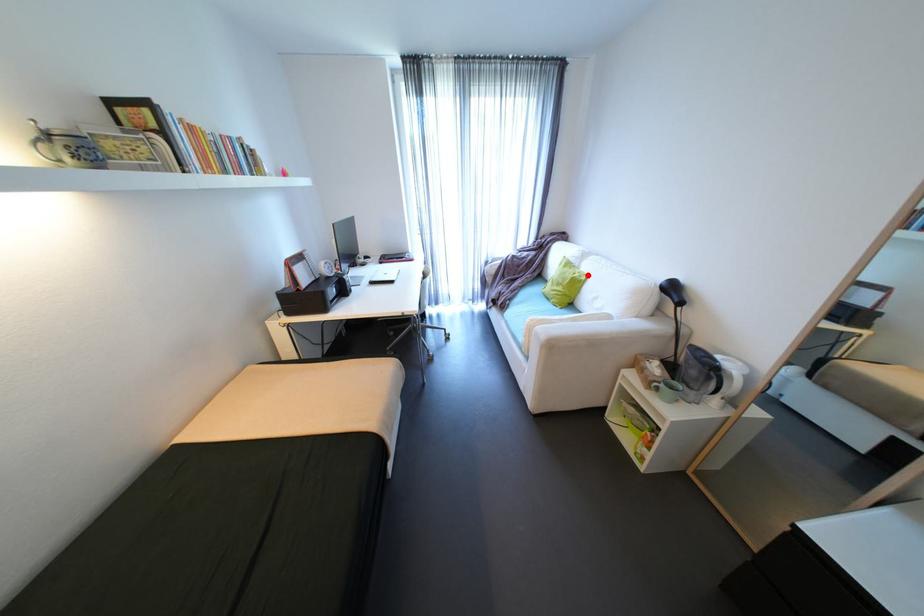
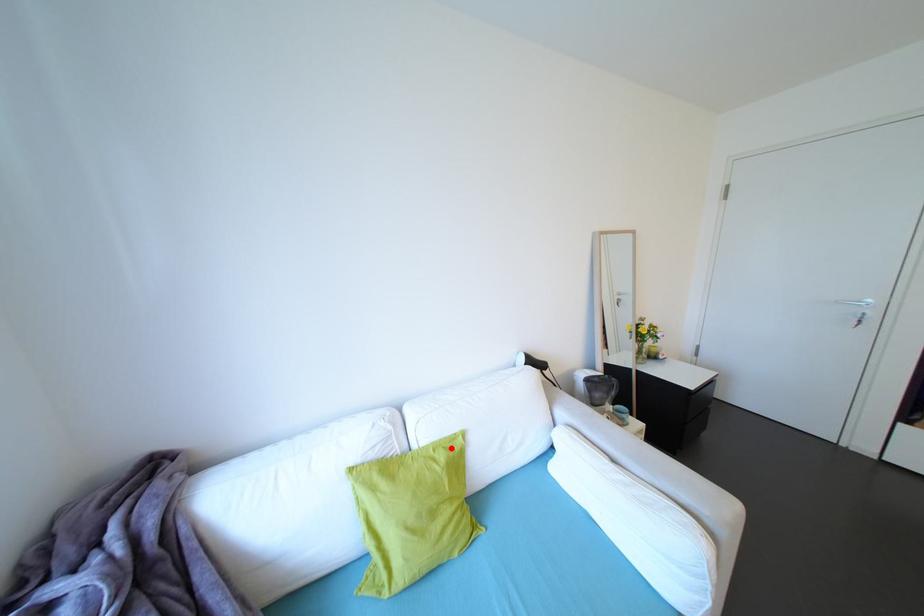
I am providing you with two images of the same scene from different viewpoints. A red point is marked on the first image and another point is marked on the second image. Is the marked point in image1 the same physical position as the marked point in image2?

Yes